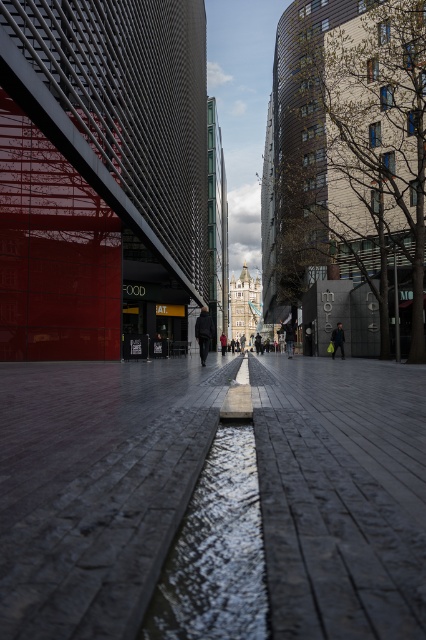
Question: Based on their relative distances, which object is nearer to the reflective concrete puddle at center?

Choices:
 (A) dark gray jacket at center
 (B) dark gray fabric jacket at center
 (C) dark gray concrete pavement at center

Answer: (C)

Question: Which object appears farthest from the camera in this image?

Choices:
 (A) dark gray concrete pavement at center
 (B) red jacket at center

Answer: (B)

Question: Is dark gray stone pavement at center above dark gray concrete pavement at center?

Choices:
 (A) no
 (B) yes

Answer: (A)

Question: In this image, where is dark gray concrete pavement at center located relative to red jacket at center?

Choices:
 (A) above
 (B) below

Answer: (A)

Question: Estimate the real-world distances between objects in this image. Which object is closer to the dark gray concrete pavement at center?

Choices:
 (A) reflective concrete puddle at center
 (B) red jacket at center

Answer: (A)

Question: From the image, what is the correct spatial relationship of dark gray stone pavement at center in relation to dark gray concrete pavement at center?

Choices:
 (A) above
 (B) below

Answer: (B)